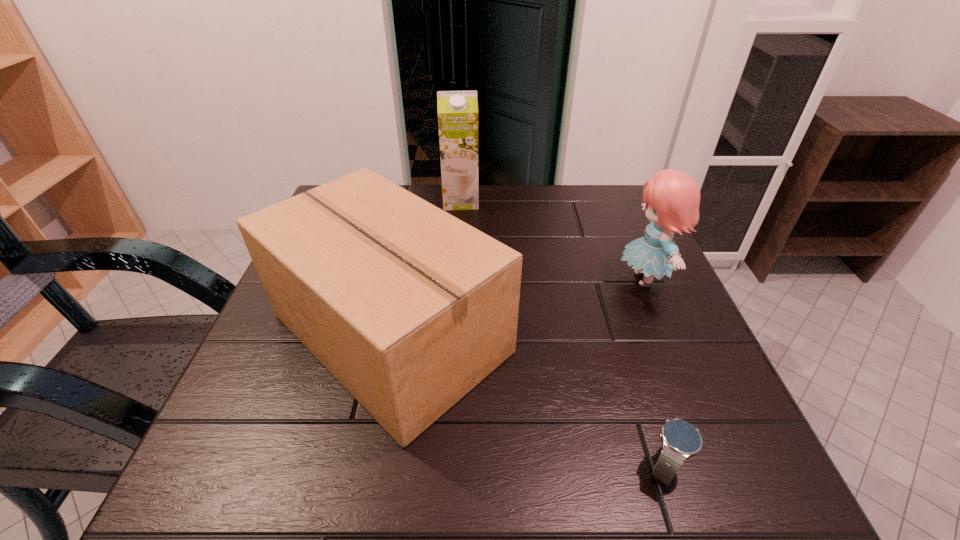
The image size is (960, 540). Find the location of `object at the far edge`. object at the far edge is located at coordinates (457, 111).

Identify the location of box located in the near edge section of the desktop. (408, 307).

At what (x,y) coordinates should I click in order to perform the action: click on watch situated at the near edge. Please return your answer as a coordinate pair (x, y). Image resolution: width=960 pixels, height=540 pixels. Looking at the image, I should click on (680, 440).

You are a GUI agent. You are given a task and a screenshot of the screen. Output one action in this format:
    pyautogui.click(x=<x>, y=<y>)
    Task: Click on the object that is at the left edge
    The width and height of the screenshot is (960, 540).
    Given the screenshot: What is the action you would take?
    pyautogui.click(x=408, y=307)

Locate an element on the screen. The image size is (960, 540). doll that is at the right edge is located at coordinates (672, 197).

Image resolution: width=960 pixels, height=540 pixels. I want to click on watch located at the right edge, so click(x=680, y=440).

At what (x,y) coordinates should I click in order to perform the action: click on object present at the near left corner. Please return your answer as a coordinate pair (x, y). Looking at the image, I should click on (408, 307).

Find the location of a particular element. object that is at the near right corner is located at coordinates [x=680, y=440].

Where is `free space at the far edge of the desktop`? The height and width of the screenshot is (540, 960). free space at the far edge of the desktop is located at coordinates tap(500, 230).

The height and width of the screenshot is (540, 960). In order to click on free space at the near edge in this screenshot , I will do `click(412, 480)`.